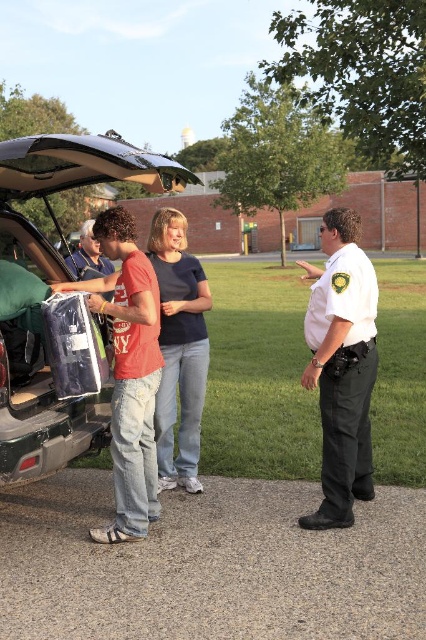
You are a pedestrian trying to cross the street and see the metallic silver car at center and the blue cotton shirt at center. Which object is closer to you?

The metallic silver car at center is closer to you because it is positioned further to the viewer than the blue cotton shirt at center.

You are a delivery person who needs to place a 40 inch package between the metallic silver car at center and the blue cotton shirt at center. Can you fit the package between them without moving either object?

The metallic silver car at center is only 35.86 inches away from the blue cotton shirt at center. Since the package is 40 inches long, it cannot fit between them without moving either object.

You are a pedestrian standing on the sidewalk across from the parking lot. You notice the metallic silver car at center and the blue cotton shirt at center. Which object appears narrower from your perspective?

The metallic silver car at center appears narrower than the blue cotton shirt at center from your perspective.